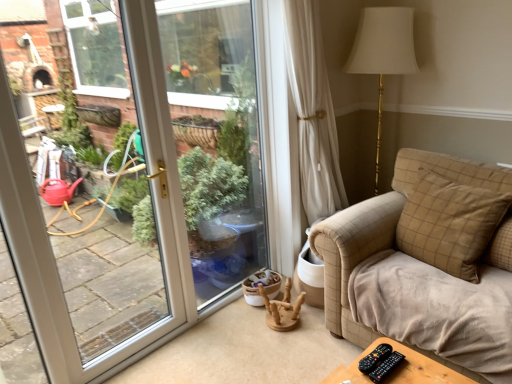
Question: Based on their positions, is black plastic remote at lower right, which ranks as the first remote in right-to-left order, located to the left or right of beige checkered pillow at right, placed as the second pillow when sorted from back to front?

Choices:
 (A) left
 (B) right

Answer: (A)

Question: Looking at their shapes, would you say black plastic remote at lower right, the 2th remote in the left-to-right sequence, is wider or thinner than beige checkered pillow at right, the 1th pillow viewed from the front?

Choices:
 (A) thin
 (B) wide

Answer: (A)

Question: Estimate the real-world distances between objects in this image. Which object is farther from the beige checkered pillow at right, placed as the second pillow when sorted from back to front?

Choices:
 (A) beige checkered pillow at right, which is counted as the first pillow, starting from the back
 (B) wooden at center
 (C) black plastic remote at lower right, the 2th remote in the left-to-right sequence
 (D) black plastic remote at lower right, which is counted as the second remote, starting from the right

Answer: (B)

Question: Considering the real-world distances, which object is farthest from the black plastic remote at lower right, which is counted as the second remote, starting from the right?

Choices:
 (A) black plastic remote at lower right, the 2th remote in the left-to-right sequence
 (B) beige checkered pillow at right, placed as the 2th pillow when sorted from front to back
 (C) beige checkered pillow at right, placed as the second pillow when sorted from back to front
 (D) wooden at center

Answer: (D)